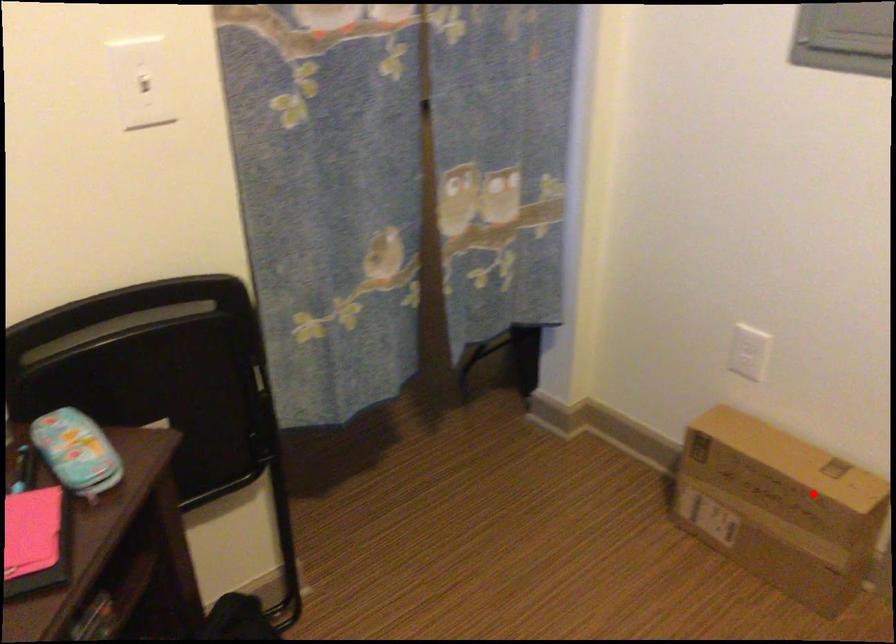
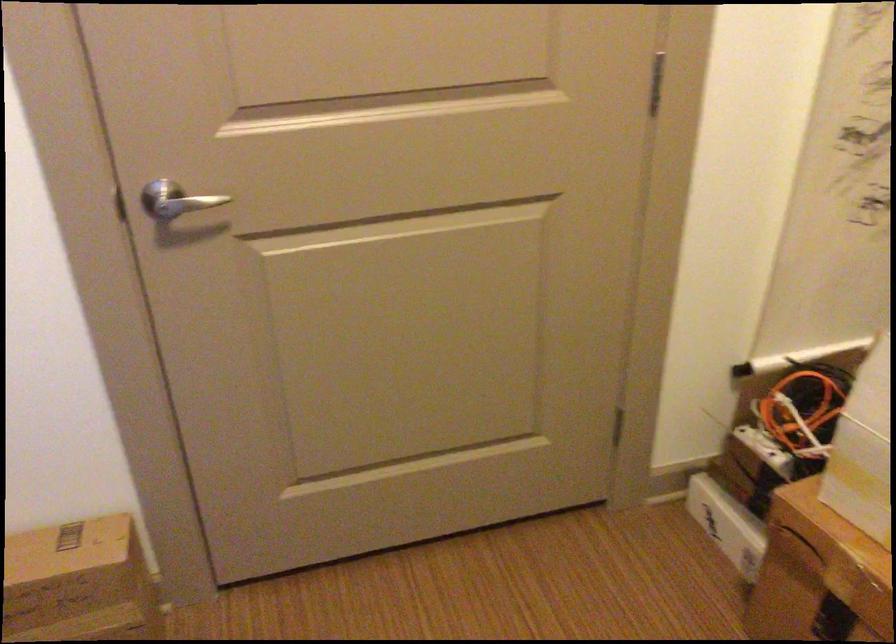
Locate, in the second image, the point that corresponds to the highlighted location in the first image.

(79, 583)